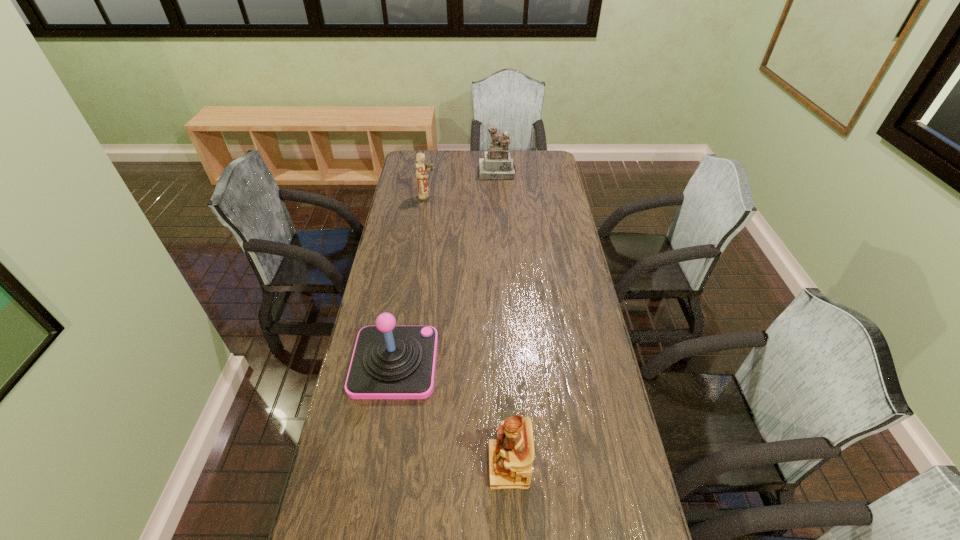
Locate which figurine ranks second in proximity to the nearest object. Please provide its 2D coordinates. Your answer should be formatted as a tuple, i.e. [(x, y)], where the tuple contains the x and y coordinates of a point satisfying the conditions above.

[(497, 164)]

Select which figurine is the closest to the farthest figurine. Please provide its 2D coordinates. Your answer should be formatted as a tuple, i.e. [(x, y)], where the tuple contains the x and y coordinates of a point satisfying the conditions above.

[(424, 195)]

The width and height of the screenshot is (960, 540). What are the coordinates of `free space that satisfies the following two spatial constraints: 1. on the front-facing side of the farthest figurine; 2. forward from the base of the third farthest object` in the screenshot? It's located at coord(508,362).

Identify the location of vacant space that satisfies the following two spatial constraints: 1. on the front-facing side of the farthest object; 2. on the front-facing side of the second nearest figurine. (498, 198).

Image resolution: width=960 pixels, height=540 pixels. I want to click on free space that satisfies the following two spatial constraints: 1. on the front-facing side of the farthest figurine; 2. on the front-facing side of the nearest figurine, so click(x=513, y=465).

This screenshot has width=960, height=540. What are the coordinates of `free location that satisfies the following two spatial constraints: 1. on the front-facing side of the farthest figurine; 2. forward from the base of the second nearest object` in the screenshot? It's located at click(508, 362).